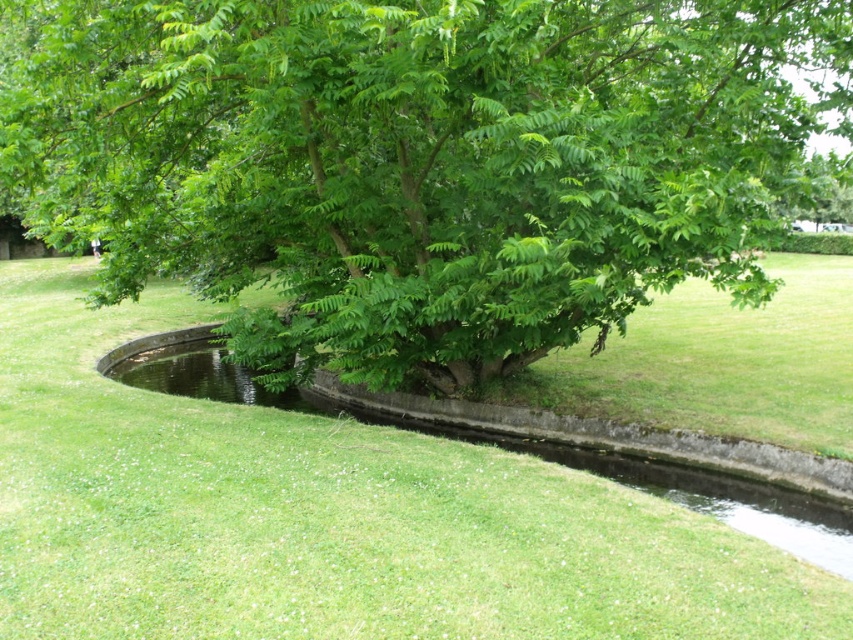
Question: Based on their relative distances, which object is farther from the clear water at center?

Choices:
 (A) green grassy at center
 (B) green leafy tree at center

Answer: (B)

Question: Which point appears farthest from the camera in this image?

Choices:
 (A) [387, 125]
 (B) [207, 340]
 (C) [699, 611]

Answer: (B)

Question: Is green grassy at center above clear water at center?

Choices:
 (A) yes
 (B) no

Answer: (A)

Question: Is green grassy at center to the left of clear water at center from the viewer's perspective?

Choices:
 (A) yes
 (B) no

Answer: (B)

Question: Estimate the real-world distances between objects in this image. Which object is farther from the green grassy at center?

Choices:
 (A) green leafy tree at center
 (B) clear water at center

Answer: (A)

Question: Does green leafy tree at center lie behind green grassy at center?

Choices:
 (A) no
 (B) yes

Answer: (B)